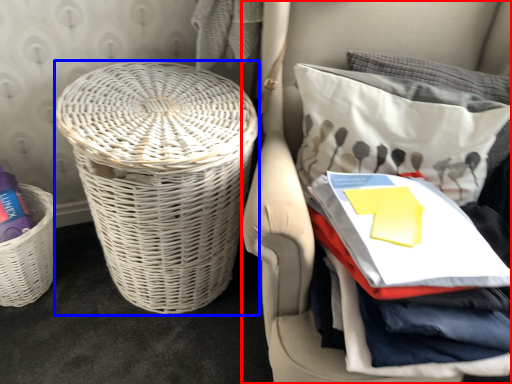
Question: Which object appears farthest to the camera in this image, furniture (highlighted by a red box) or basket (highlighted by a blue box)?

Choices:
 (A) furniture
 (B) basket

Answer: (B)